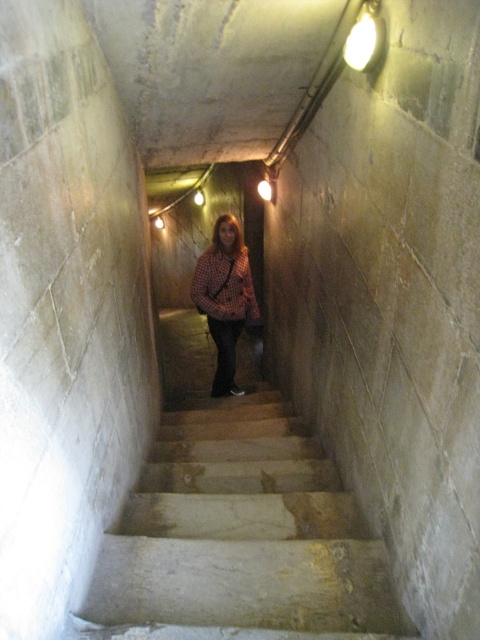
You are standing at the bottom of the staircase and want to climb up. You notice the concrete stairs at center and the checkered fabric shirt at center. Which object is taller?

The checkered fabric shirt at center is taller than the concrete stairs at center.

You are standing at the bottom of the staircase and want to climb up while avoiding the checkered fabric shirt at center. Since the concrete stairs at center are in your path, where should you step to avoid it?

The concrete stairs at center is on the right side of the checkered fabric shirt at center, so you should step to the left side of the checkered fabric shirt at center to avoid it.